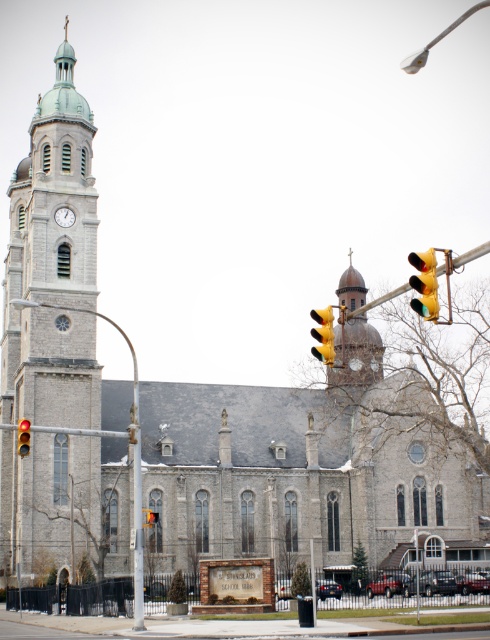
Question: Which of the following is the closest to the observer?

Choices:
 (A) yellow plastic traffic light at upper center
 (B) yellow matte traffic light at upper right
 (C) yellow matte traffic light at center
 (D) brown stone clock tower at center

Answer: (B)

Question: Among these objects, which one is farthest from the camera?

Choices:
 (A) yellow plastic traffic light at upper center
 (B) yellow matte traffic light at upper right

Answer: (A)

Question: Which object is positioned farthest from the white clock face at upper left?

Choices:
 (A) yellow plastic traffic light at upper center
 (B) yellow matte traffic light at upper right
 (C) red glass traffic light at upper right

Answer: (B)

Question: Where is yellow matte traffic light at upper right located in relation to white clock face at upper left in the image?

Choices:
 (A) below
 (B) above

Answer: (A)

Question: Does yellow matte traffic light at center lie behind yellow plastic traffic light at upper center?

Choices:
 (A) yes
 (B) no

Answer: (B)

Question: Can you confirm if gray stone clock tower at left is smaller than white clock face at upper left?

Choices:
 (A) yes
 (B) no

Answer: (B)